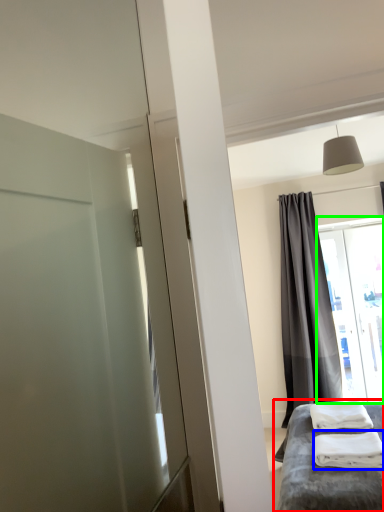
Question: Estimate the real-world distances between objects in this image. Which object is closer to furniture (highlighted by a red box), material (highlighted by a blue box) or window (highlighted by a green box)?

Choices:
 (A) material
 (B) window

Answer: (A)